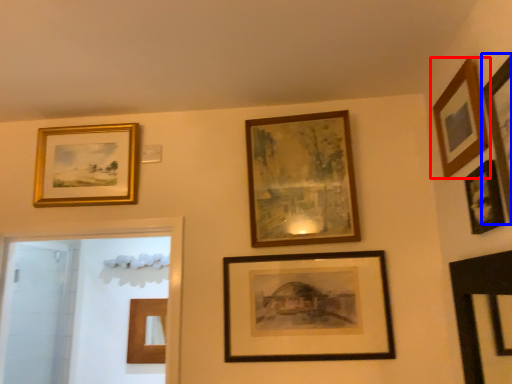
Question: Which object appears farthest to the camera in this image, picture frame (highlighted by a red box) or picture frame (highlighted by a blue box)?

Choices:
 (A) picture frame
 (B) picture frame

Answer: (A)